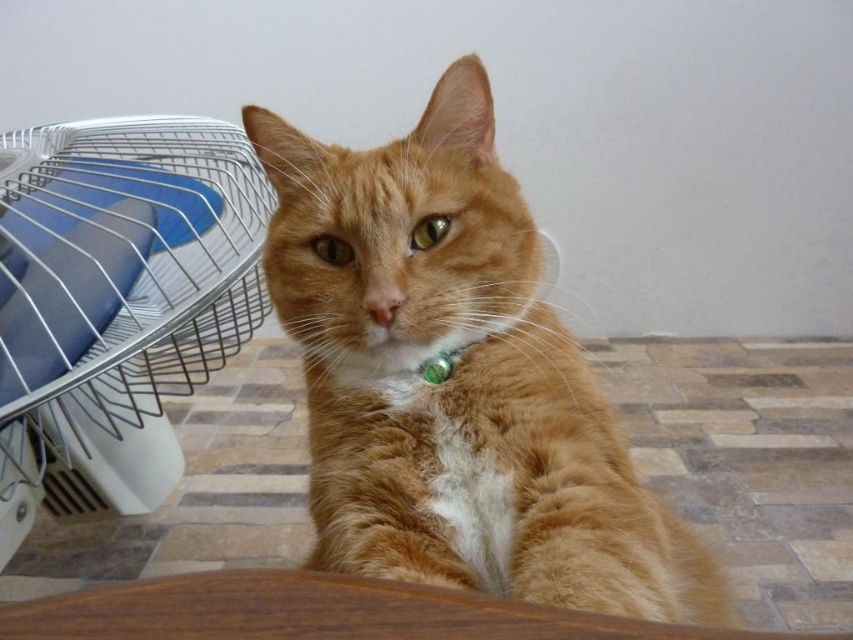
You are a photographer setting up a shoot with the orange fur cat at center and the white plastic fan at left in the frame. You need to ensure that the cat is the main focus. Which object should you adjust the camera settings to prioritize based on their sizes?

The orange fur cat at center is smaller than the white plastic fan at left, so you should adjust the camera settings to prioritize focusing on the smaller orange fur cat at center to ensure it remains the main focus.

Based on the scene description, where is the orange fur cat at center located in terms of coordinates?

The orange fur cat at center is located at coordinates point (456, 380).

You are holding a toy mouse that is 12 inches long. You want to place it on the floor so that it is exactly halfway between the camera and the point at coordinates point (479, 241). Where should you place the toy mouse?

The point at coordinates point (479, 241) is 27.28 inches away from the camera. To place the toy mouse halfway, you should position it at 13.64 inches from the camera along the line towards point 0.378, (479, 241).